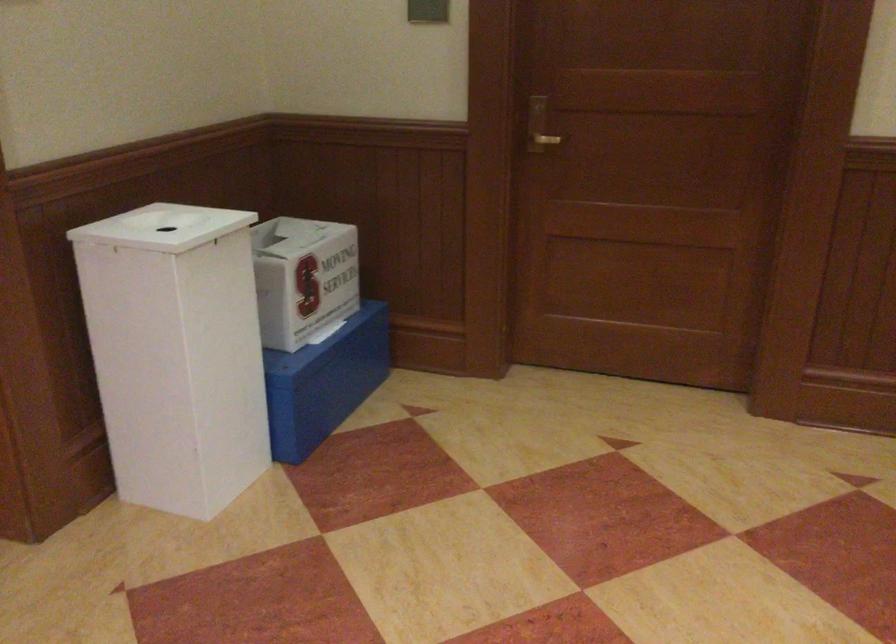
Find where to turn the gold door handle. Please return your answer as a coordinate pair (x, y).

(538, 126)